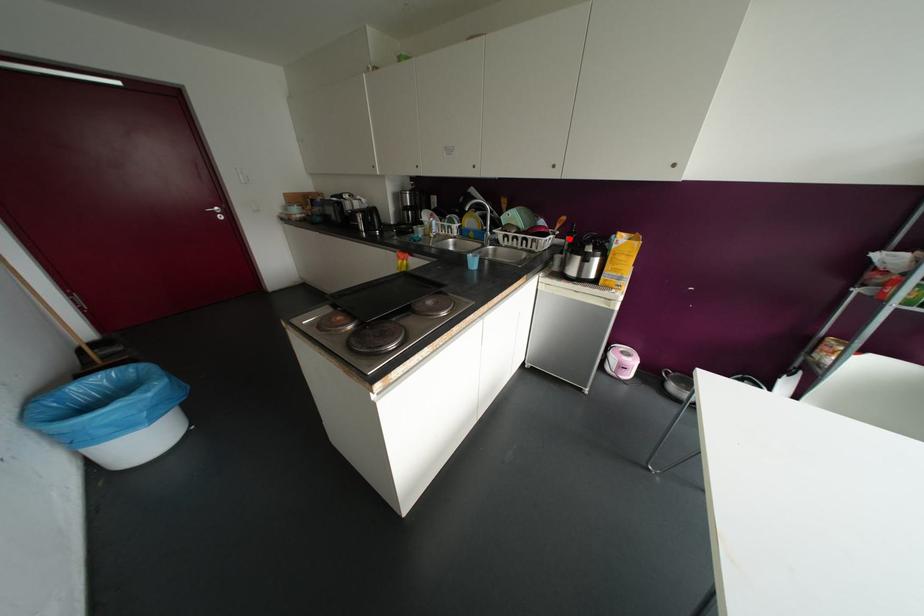
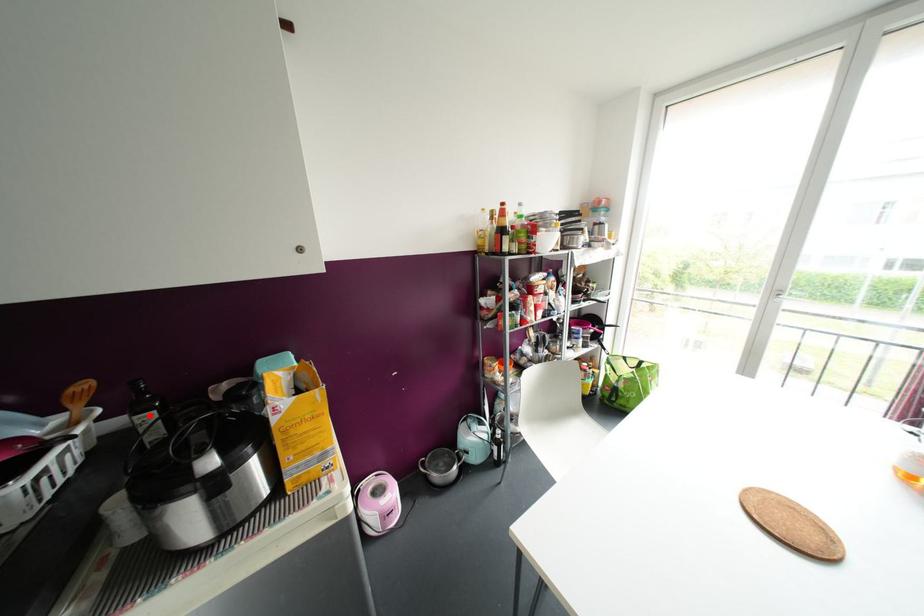
I am providing you with two images of the same scene from different viewpoints. A red point is marked on the first image and another point is marked on the second image. Does the point marked in image1 correspond to the same location as the one in image2?

Yes